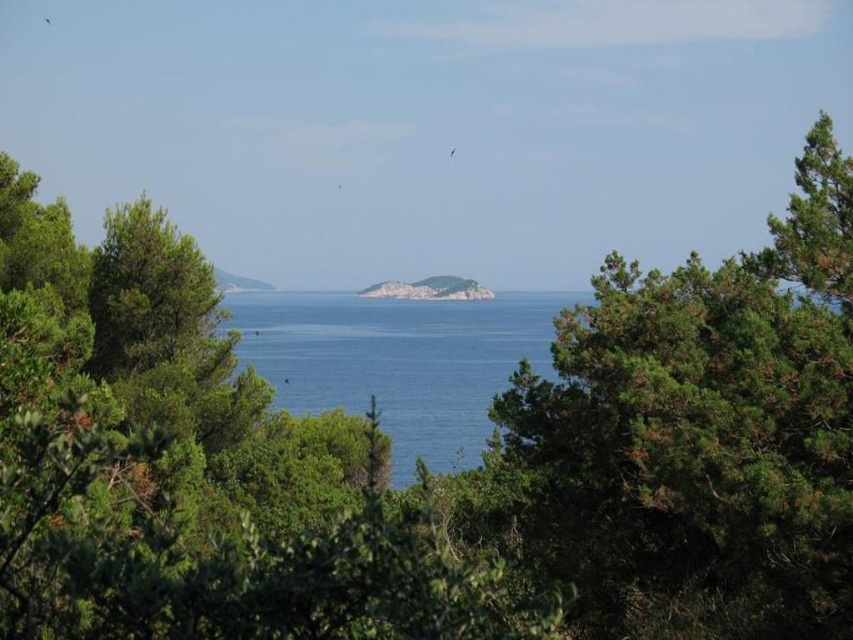
You are standing on the shore looking out at the scene. Which object is closer to you, the blue water at center or the rugged stone island at center?

The blue water at center is closer to you because it is positioned in front of the rugged stone island at center.

You are standing at the edge of the dense greenery in the foreground of the coastal landscape. You want to walk directly towards the blue water at center marked by point [397,360]. Which direction should you head?

You should head towards the center of the image where the blue water is located, as the point [397,360] marks the blue water at center.

You are a boat captain planning to navigate a vessel with a draft of 10 feet through the channel between the blue water at center and the rugged stone island at center. Is the depth sufficient for safe passage?

The blue water at center and rugged stone island at center are 89.80 feet apart from each other. Since the boat has a draft of 10 feet, the depth between them is sufficient for safe passage as long as the water depth exceeds the draft requirement. However, the distance provided refers to separation between the two objects, not the water depth. Without specific depth information, it is impossible to confirm if the draft is safe.